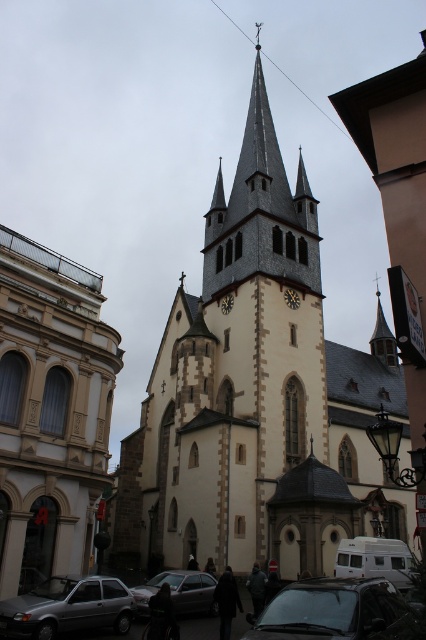
Does point (402, 531) come closer to viewer compared to point (66, 602)?

That is False.

The width and height of the screenshot is (426, 640). What do you see at coordinates (258, 396) in the screenshot?
I see `white stone tower at center` at bounding box center [258, 396].

Locate an element on the screen. Image resolution: width=426 pixels, height=640 pixels. white stone tower at center is located at coordinates (258, 396).

Is point (307, 250) closer to viewer compared to point (55, 419)?

No, it is behind (55, 419).

Does white stone tower at center appear on the right side of beige stone church at center?

Indeed, white stone tower at center is positioned on the right side of beige stone church at center.

This screenshot has height=640, width=426. What do you see at coordinates (258, 396) in the screenshot? I see `white stone tower at center` at bounding box center [258, 396].

Locate an element on the screen. The image size is (426, 640). white stone tower at center is located at coordinates (258, 396).

Can you confirm if beige stone church at center is smaller than silver metallic sedan at lower center?

Incorrect, beige stone church at center is not smaller in size than silver metallic sedan at lower center.

Is beige stone church at center positioned before silver metallic sedan at lower center?

Yes, it is in front of silver metallic sedan at lower center.

Which is behind, point (77, 557) or point (146, 609)?

Point (77, 557)

Find the location of a particular element. This screenshot has width=426, height=640. beige stone church at center is located at coordinates (51, 412).